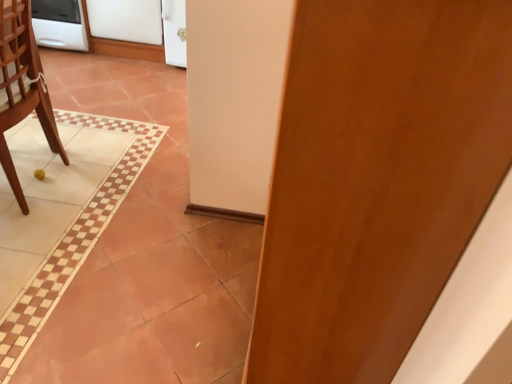
Question: Considering the relative sizes of wooden chair at left and white glossy oven at upper left in the image provided, is wooden chair at left bigger than white glossy oven at upper left?

Choices:
 (A) no
 (B) yes

Answer: (B)

Question: From a real-world perspective, is wooden chair at left over white glossy oven at upper left?

Choices:
 (A) no
 (B) yes

Answer: (B)

Question: Is wooden chair at left thinner than white glossy oven at upper left?

Choices:
 (A) yes
 (B) no

Answer: (A)

Question: Does wooden chair at left have a smaller size compared to white glossy oven at upper left?

Choices:
 (A) yes
 (B) no

Answer: (B)

Question: Is white glossy oven at upper left located within wooden chair at left?

Choices:
 (A) yes
 (B) no

Answer: (B)

Question: Does wooden chair at left lie in front of white glossy oven at upper left?

Choices:
 (A) no
 (B) yes

Answer: (B)

Question: From a real-world perspective, is wooden door at center positioned over white matte refrigerator at upper left, which appears as the 1th screen door when viewed from the left, based on gravity?

Choices:
 (A) yes
 (B) no

Answer: (A)

Question: Does wooden door at center appear on the right side of white matte refrigerator at upper left, which appears as the 1th screen door when viewed from the left?

Choices:
 (A) yes
 (B) no

Answer: (A)

Question: Would you say wooden door at center contains white matte refrigerator at upper left, which appears as the 1th screen door when viewed from the left?

Choices:
 (A) no
 (B) yes

Answer: (A)

Question: Is wooden door at center further to camera compared to white matte refrigerator at upper left, which appears as the 1th screen door when viewed from the left?

Choices:
 (A) no
 (B) yes

Answer: (A)

Question: From the image's perspective, is wooden door at center above white matte refrigerator at upper left, which appears as the 1th screen door when viewed from the left?

Choices:
 (A) no
 (B) yes

Answer: (A)

Question: Is wooden door at center taller than white matte refrigerator at upper left, which appears as the 1th screen door when viewed from the left?

Choices:
 (A) yes
 (B) no

Answer: (A)

Question: Does white glossy oven at upper left appear on the right side of white glossy screen door at upper center, positioned as the second screen door in left-to-right order?

Choices:
 (A) no
 (B) yes

Answer: (A)